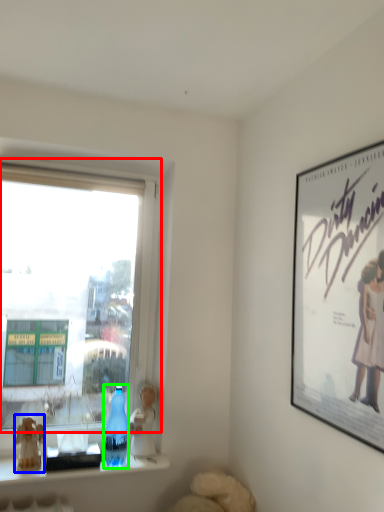
Question: Considering the real-world distances, which object is farthest from window (highlighted by a red box)? figurine (highlighted by a blue box) or bottle (highlighted by a green box)?

Choices:
 (A) figurine
 (B) bottle

Answer: (A)